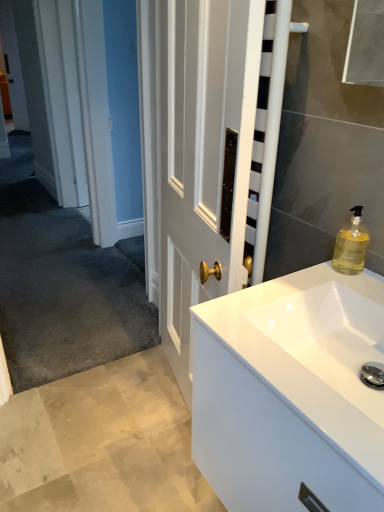
Locate an element on the screen. vacant space situated on the left part of translucent yellow liquid at upper right is located at coordinates (300, 280).